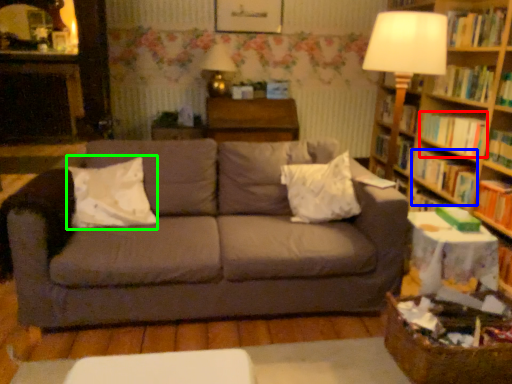
Question: Based on their relative distances, which object is nearer to book (highlighted by a red box)? Choose from book (highlighted by a blue box) and pillow (highlighted by a green box).

Choices:
 (A) book
 (B) pillow

Answer: (A)